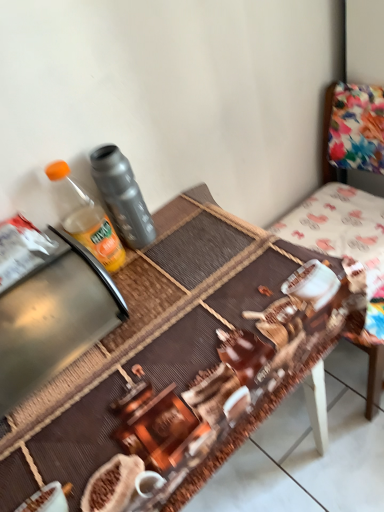
Locate an element on the screen. vacant region in front of metallic stainless steel appliance at left is located at coordinates (85, 425).